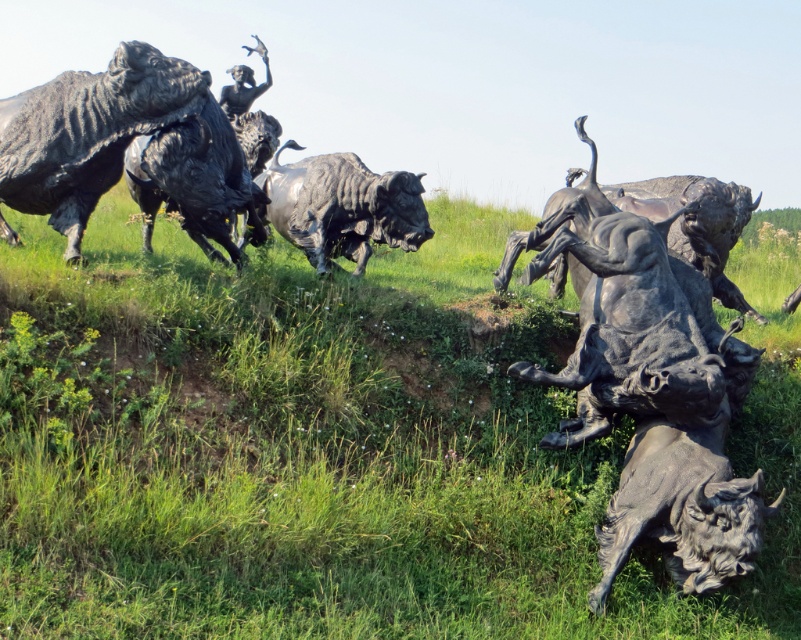
You are an art curator planning to move the bronze textured bison at left closer to the bronze textured bison at center for a new exhibit. Considering their sizes, which bison will appear more dominant in the composition after the move?

The bronze textured bison at center will appear more dominant in the composition after moving the bronze textured bison at left closer because it is larger in size compared to the bronze textured bison at left.

You are a photographer standing at the edge of the grassy landscape where the bronze textured bison at center is located. You want to capture a closeup shot of the bison statue. Given that your camera has a minimum focusing distance of 15 feet, will you be able to take the photo without moving closer?

The bronze textured bison at center is 14.69 feet away from the camera. Since the minimum focusing distance is 15 feet, you are slightly too close to focus properly. You need to move back about 0.31 feet to achieve focus.